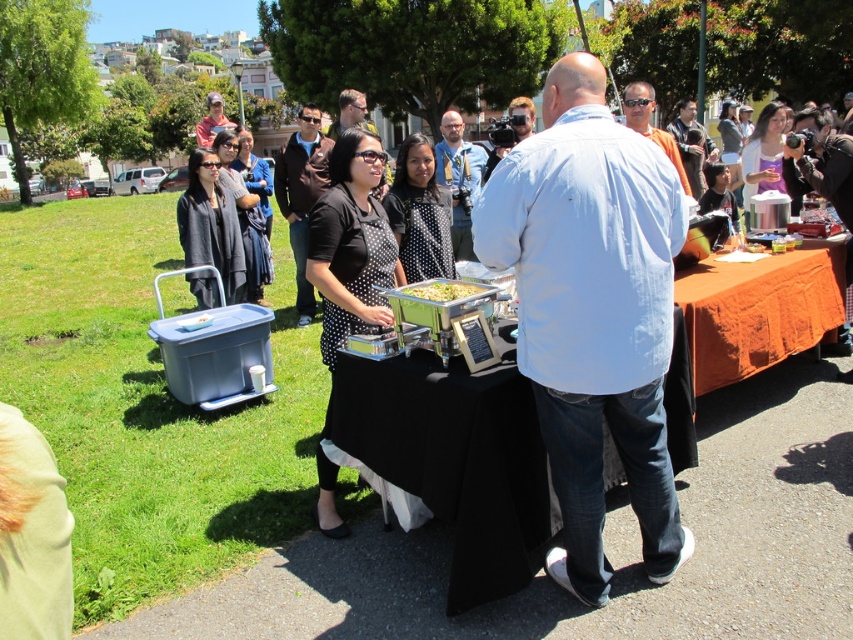
Does black fabric table at center appear on the left side of orange t-shirt at center?

Yes, black fabric table at center is to the left of orange t-shirt at center.

Which is more to the right, black fabric table at center or orange t-shirt at center?

From the viewer's perspective, orange t-shirt at center appears more on the right side.

Is point (503, 568) in front of point (674, 156)?

Yes, point (503, 568) is in front of point (674, 156).

Where is `black fabric table at center`? The image size is (853, 640). black fabric table at center is located at coordinates [x=456, y=460].

Does light blue denim shirt at center appear on the left side of matte gray shirt at upper center?

In fact, light blue denim shirt at center is to the right of matte gray shirt at upper center.

Consider the image. Which is above, light blue denim shirt at center or matte gray shirt at upper center?

matte gray shirt at upper center

Which is in front, point (593, 195) or point (221, 104)?

Point (593, 195) is in front.

Locate an element on the screen. light blue denim shirt at center is located at coordinates (592, 314).

Who is taller, orange t-shirt at center or light blue shirt at center?

light blue shirt at center is taller.

Does orange t-shirt at center have a greater height compared to light blue shirt at center?

No, orange t-shirt at center is not taller than light blue shirt at center.

Where is `orange t-shirt at center`? Image resolution: width=853 pixels, height=640 pixels. orange t-shirt at center is located at coordinates (650, 124).

Locate an element on the screen. The height and width of the screenshot is (640, 853). orange t-shirt at center is located at coordinates (650, 124).